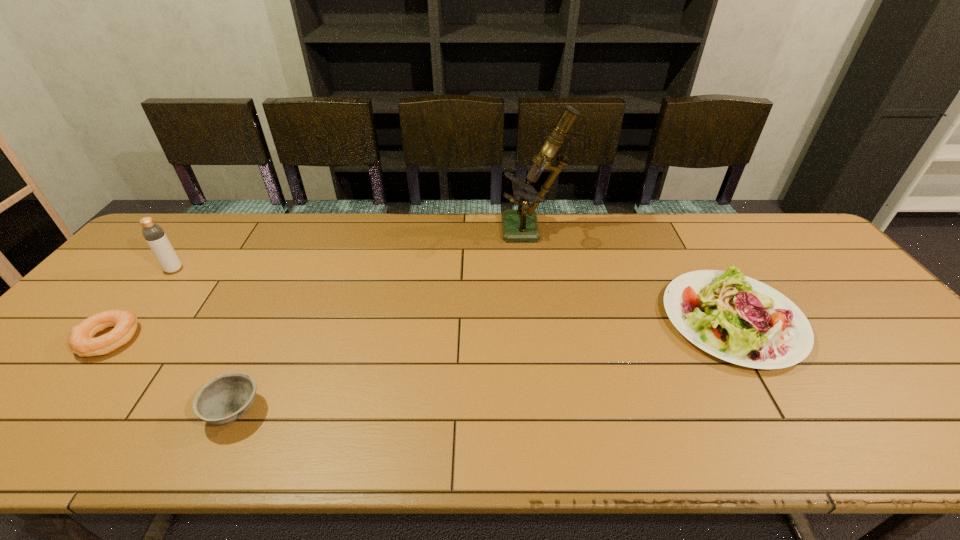
Locate an element on the screen. free spot between the salad plate and the tallest object is located at coordinates (633, 275).

The width and height of the screenshot is (960, 540). What are the coordinates of `free space between the tallest object and the rightmost object` in the screenshot? It's located at (633, 275).

Find the location of `vacant area that lies between the farthest object and the bottle`. vacant area that lies between the farthest object and the bottle is located at coordinates (353, 251).

Where is `vacant space in between the bagel and the bowl`? The image size is (960, 540). vacant space in between the bagel and the bowl is located at coordinates (172, 375).

Image resolution: width=960 pixels, height=540 pixels. Find the location of `free space between the salad plate and the tallest object`. free space between the salad plate and the tallest object is located at coordinates (633, 275).

Where is `object that is the closest to the bowl`? The height and width of the screenshot is (540, 960). object that is the closest to the bowl is located at coordinates [x=81, y=341].

Locate an element on the screen. This screenshot has width=960, height=540. object that is the fourth closest to the second shortest object is located at coordinates (736, 318).

What are the coordinates of `vacant space that satisfies the following two spatial constraints: 1. on the front side of the bagel; 2. on the right side of the third object from left to right` in the screenshot? It's located at (49, 411).

Where is `free location that satisfies the following two spatial constraints: 1. on the back side of the third shortest object; 2. at the eyepiece of the fourth object from left to right`? free location that satisfies the following two spatial constraints: 1. on the back side of the third shortest object; 2. at the eyepiece of the fourth object from left to right is located at coordinates (681, 231).

The height and width of the screenshot is (540, 960). In order to click on blank space that satisfies the following two spatial constraints: 1. on the back side of the salad plate; 2. at the eyepiece of the tallest object in this screenshot , I will do 681,231.